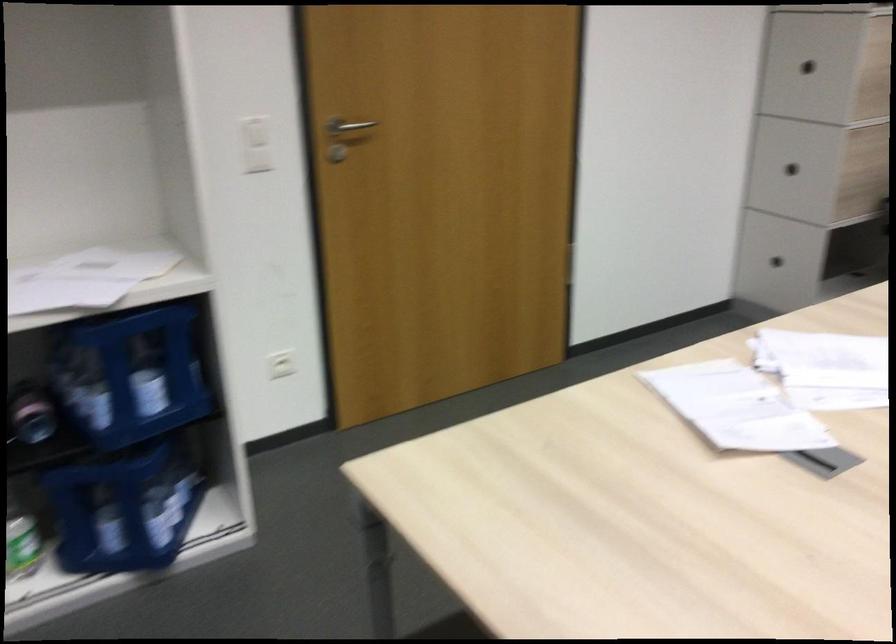
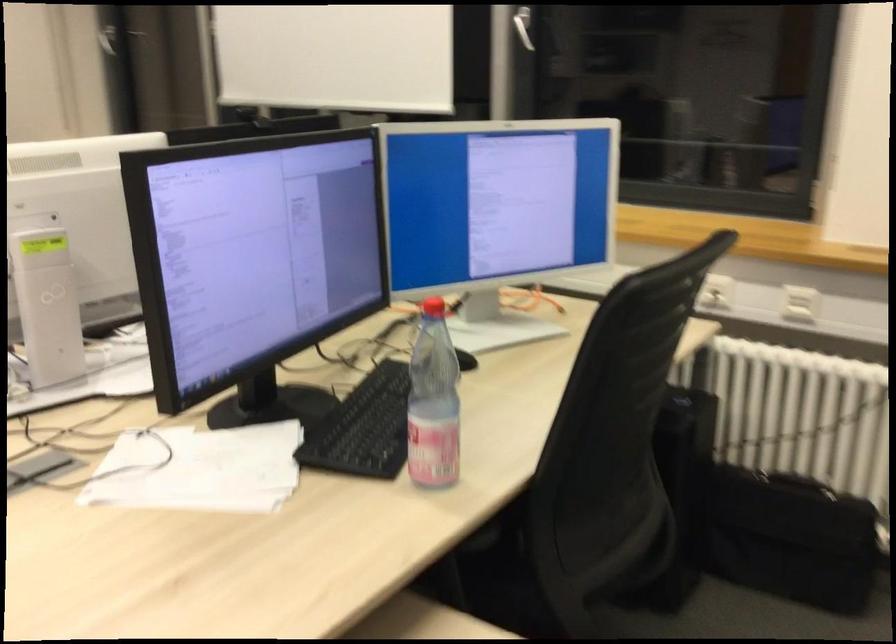
First-person continuous shooting, in which direction is the camera rotating?

The camera rotated toward right-down.